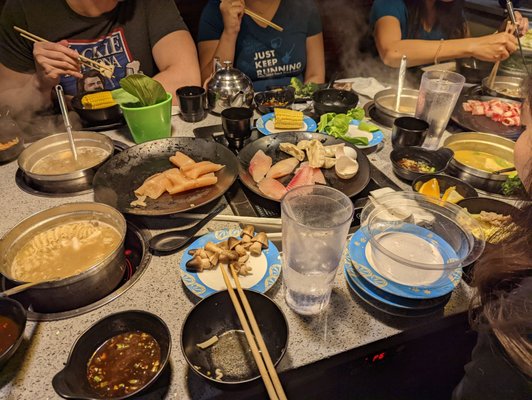
The width and height of the screenshot is (532, 400). Identify the location of teapot. (230, 86).